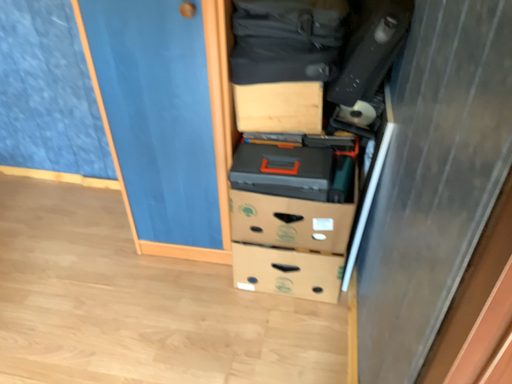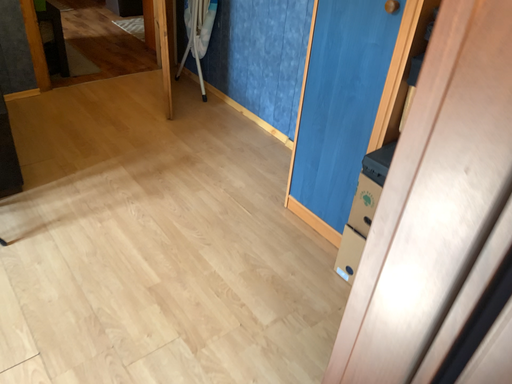
Question: How did the camera likely rotate when shooting the video?

Choices:
 (A) rotated downward
 (B) rotated upward

Answer: (B)